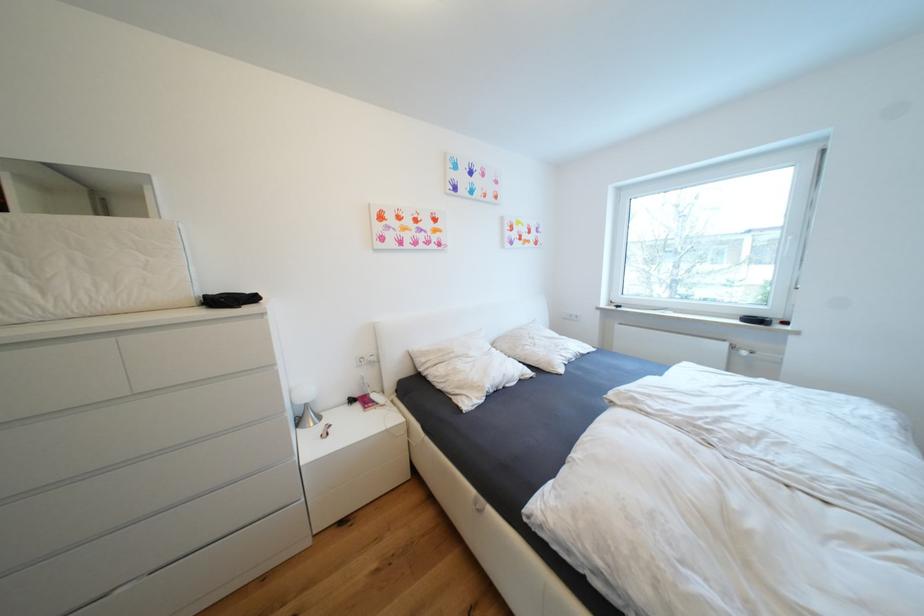
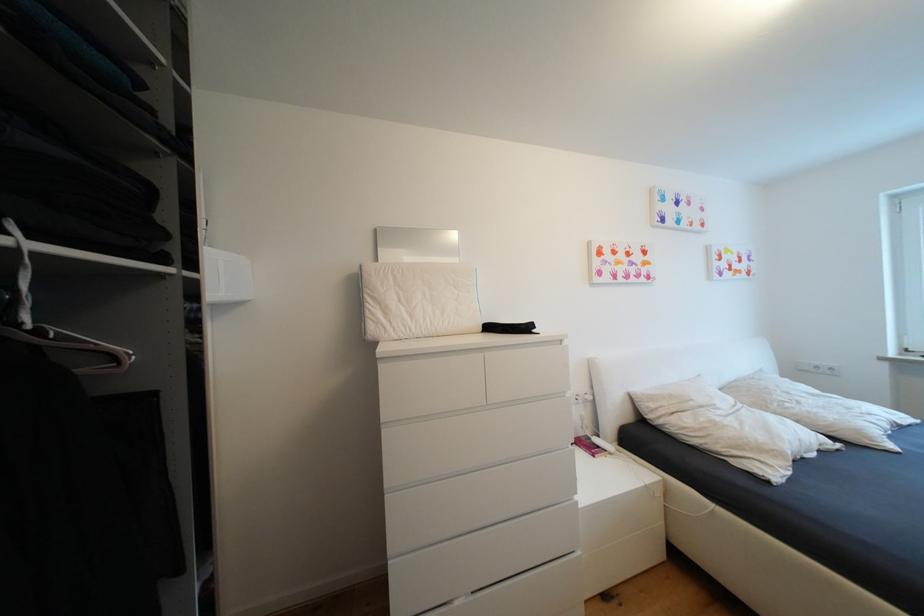
Question: What movement of the cameraman would produce the second image?

Choices:
 (A) Left
 (B) Right
 (C) Forward
 (D) Backward

Answer: (A)